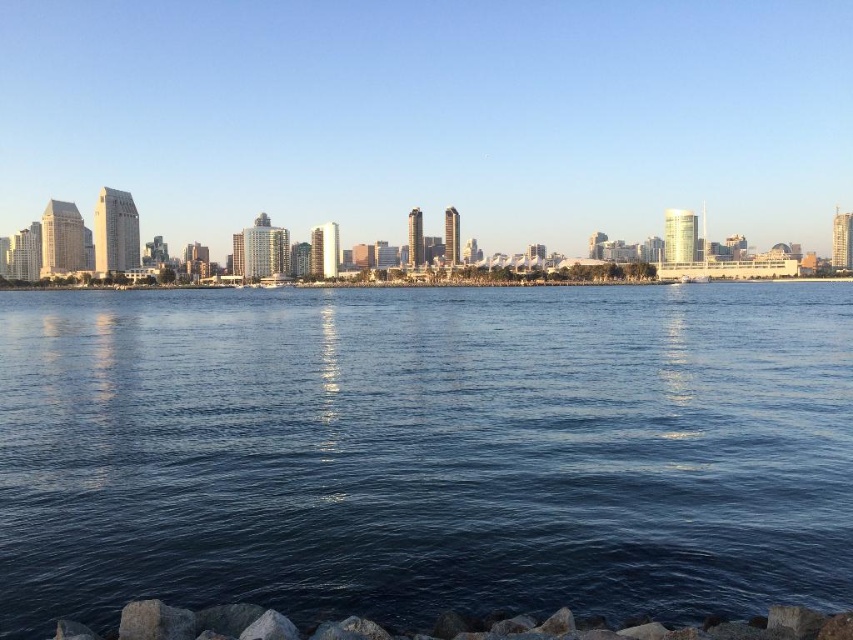
Between blue liquid water at center and gray rock at lower center, which one appears on the left side from the viewer's perspective?

blue liquid water at center is more to the left.

Does point (113, 333) come farther from viewer compared to point (239, 609)?

Yes, point (113, 333) is behind point (239, 609).

You are a GUI agent. You are given a task and a screenshot of the screen. Output one action in this format:
    pyautogui.click(x=<x>, y=<y>)
    Task: Click on the blue liquid water at center
    Image resolution: width=853 pixels, height=640 pixels.
    Given the screenshot: What is the action you would take?
    pyautogui.click(x=425, y=451)

Image resolution: width=853 pixels, height=640 pixels. Find the location of `blue liquid water at center`. blue liquid water at center is located at coordinates (425, 451).